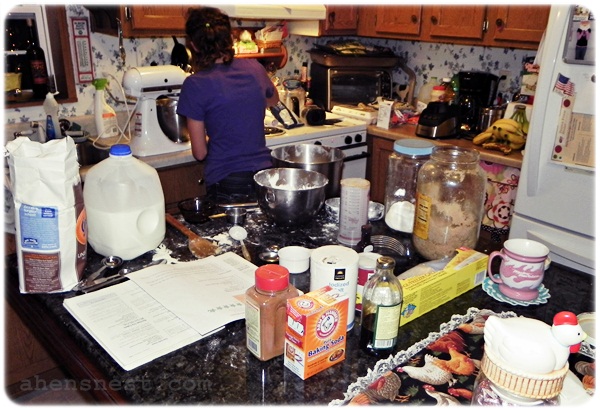
I want to click on granite countertop, so click(x=202, y=377).